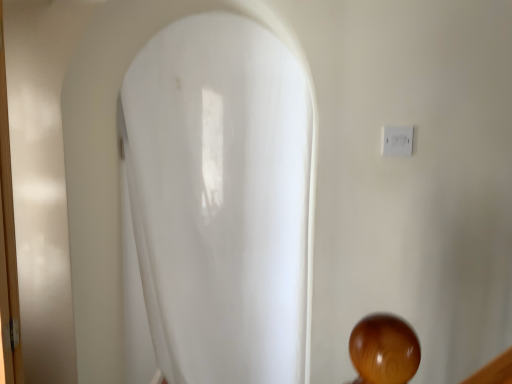
Describe the element at coordinates (7, 246) in the screenshot. I see `white glossy screen door at left` at that location.

What is the approximate width of white glossy screen door at left?

4.14 inches.

Where is `white glossy screen door at left`? The image size is (512, 384). white glossy screen door at left is located at coordinates (7, 246).

Image resolution: width=512 pixels, height=384 pixels. Find the location of `white glossy screen door at left`. white glossy screen door at left is located at coordinates (7, 246).